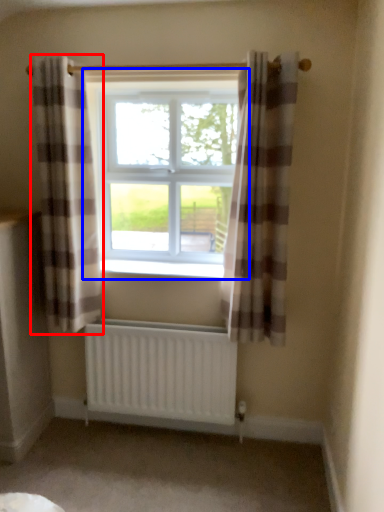
Question: Which object appears farthest to the camera in this image, curtain (highlighted by a red box) or window (highlighted by a blue box)?

Choices:
 (A) curtain
 (B) window

Answer: (B)